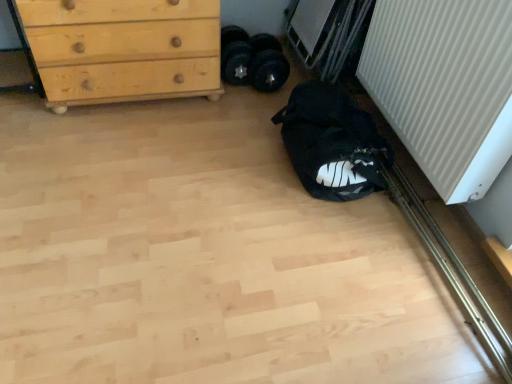
I want to click on free space on the front side of black fabric bag at lower right, so 313,233.